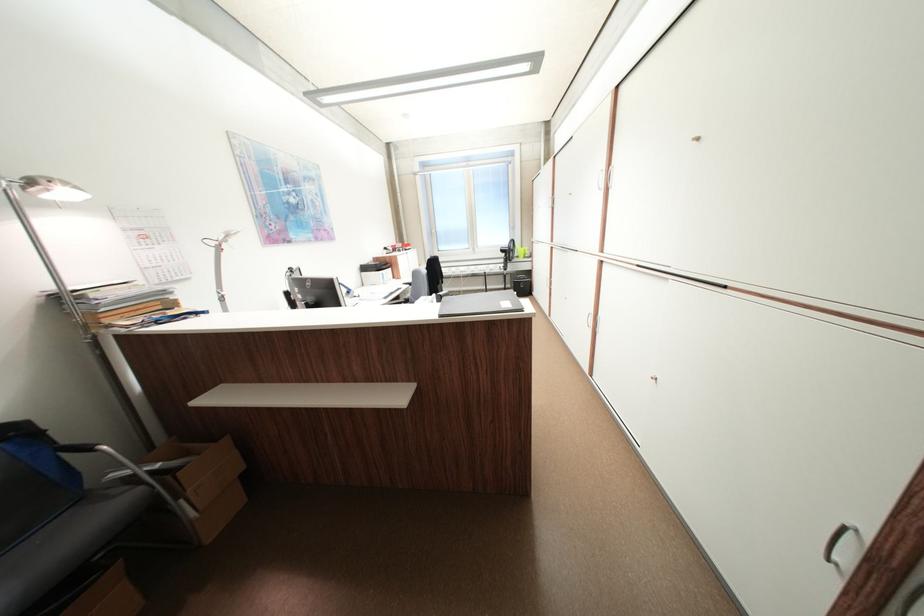
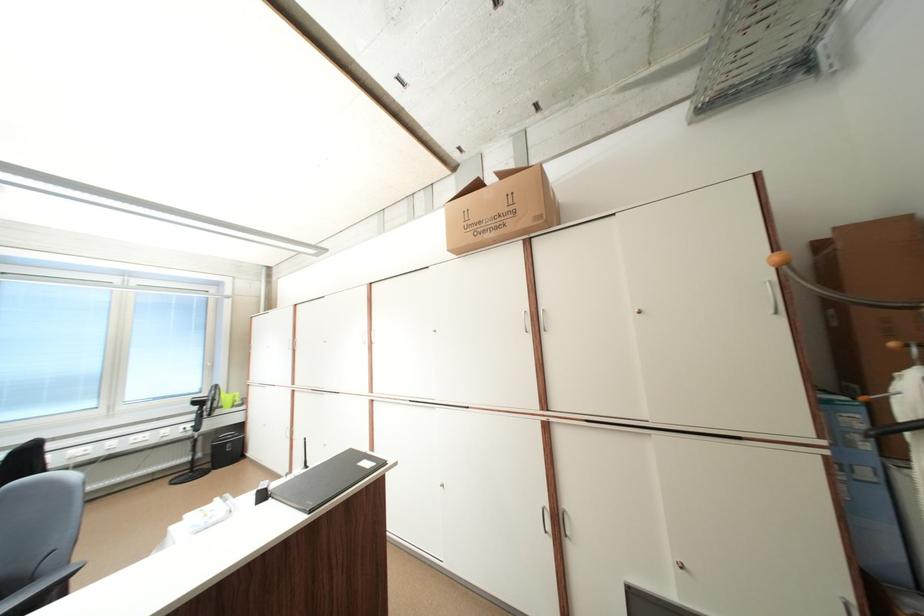
Based on the photo, first-person continuous shooting, in which direction is the camera rotating?

The camera rotated toward right-up.